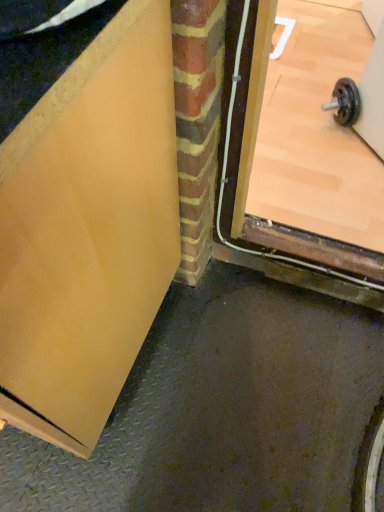
Question: Does matte yellow door at upper left, which is the 2th door from back to front, have a greater width compared to matte wood door at center, the second door when ordered from front to back?

Choices:
 (A) yes
 (B) no

Answer: (B)

Question: Can we say matte yellow door at upper left, which is the first door in left-to-right order, lies outside matte wood door at center, the second door when ordered from front to back?

Choices:
 (A) no
 (B) yes

Answer: (B)

Question: Is matte yellow door at upper left, which is the 2th door from back to front, bigger than matte wood door at center, the 1th door when ordered from right to left?

Choices:
 (A) no
 (B) yes

Answer: (B)

Question: Does matte yellow door at upper left, which is counted as the first door, starting from the front, lie in front of matte wood door at center, the second door when ordered from front to back?

Choices:
 (A) yes
 (B) no

Answer: (A)

Question: Is there a large distance between matte yellow door at upper left, which is the first door in left-to-right order, and matte wood door at center, which appears as the 1th door when viewed from the back?

Choices:
 (A) yes
 (B) no

Answer: (B)

Question: Considering the relative sizes of matte yellow door at upper left, which is counted as the first door, starting from the front, and matte wood door at center, the 1th door when ordered from right to left, in the image provided, is matte yellow door at upper left, which is counted as the first door, starting from the front, thinner than matte wood door at center, the 1th door when ordered from right to left,?

Choices:
 (A) yes
 (B) no

Answer: (A)

Question: Can you confirm if matte wood door at center, the second door when ordered from front to back, is smaller than matte yellow door at upper left, which is counted as the first door, starting from the front?

Choices:
 (A) no
 (B) yes

Answer: (B)

Question: Considering the relative sizes of matte wood door at center, which appears as the 1th door when viewed from the back, and matte yellow door at upper left, which is counted as the first door, starting from the front, in the image provided, is matte wood door at center, which appears as the 1th door when viewed from the back, taller than matte yellow door at upper left, which is counted as the first door, starting from the front,?

Choices:
 (A) no
 (B) yes

Answer: (A)

Question: Considering the relative positions of matte wood door at center, the 1th door when ordered from right to left, and matte yellow door at upper left, which is the 2th door from back to front, in the image provided, is matte wood door at center, the 1th door when ordered from right to left, behind matte yellow door at upper left, which is the 2th door from back to front,?

Choices:
 (A) yes
 (B) no

Answer: (A)

Question: Is matte yellow door at upper left, which is the first door in left-to-right order, at the back of matte wood door at center, which appears as the 1th door when viewed from the back?

Choices:
 (A) no
 (B) yes

Answer: (A)

Question: Is matte wood door at center, the 1th door when ordered from right to left, outside matte yellow door at upper left, which is the first door in left-to-right order?

Choices:
 (A) yes
 (B) no

Answer: (A)

Question: Is the position of matte wood door at center, which appears as the 1th door when viewed from the back, less distant than that of matte yellow door at upper left, which is the 2th door from back to front?

Choices:
 (A) yes
 (B) no

Answer: (B)

Question: Is point (269, 227) closer or farther from the camera than point (165, 117)?

Choices:
 (A) farther
 (B) closer

Answer: (A)